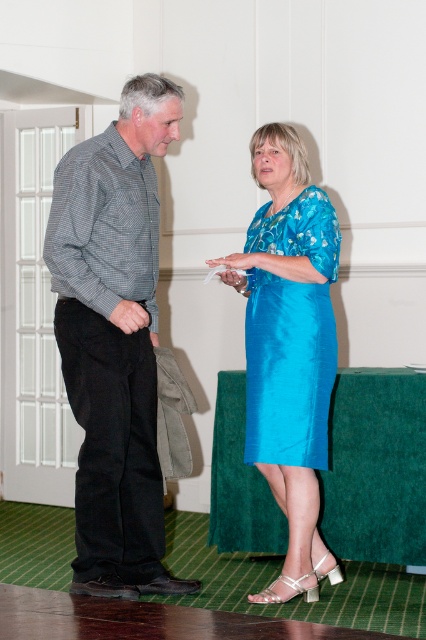
Where is the checkered fabric shirt at left located in the image?

The checkered fabric shirt at left is located at point (114, 340) in the image.

You are standing at the camera position and want to hand a gift to the person wearing the checkered fabric shirt at left. The gift box you have is 2 meters long. Can you throw it directly to them without it hitting any obstacles?

The distance between you and the checkered fabric shirt at left is 3.15 meters. Since the gift box is only 2 meters long, it cannot reach the person. You need to move closer or find another way to deliver the gift.

You are a photographer at the event and want to capture both the checkered fabric shirt at left and the matte blue dress at center in a single frame. Which of the two clothing items should you focus on first to ensure they are both in the frame?

The checkered fabric shirt at left is bigger than the matte blue dress at center, so you should focus on the checkered fabric shirt at left first to ensure both are in the frame.